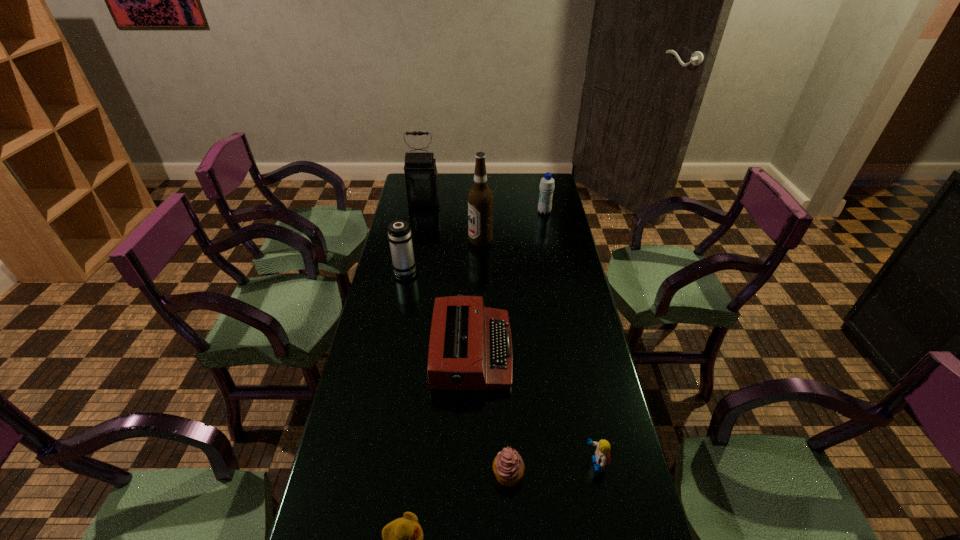
In the image, there is a desktop. At what (x,y) coordinates should I click in order to perform the action: click on vacant space at the far right corner. Please return your answer as a coordinate pair (x, y). Looking at the image, I should click on (539, 179).

I want to click on free space between the typewriter and the water bottle, so click(x=508, y=282).

Where is `free space between the sixth nearest object and the second tallest object`? The height and width of the screenshot is (540, 960). free space between the sixth nearest object and the second tallest object is located at coordinates (452, 221).

At what (x,y) coordinates should I click in order to perform the action: click on free spot between the water bottle and the cupcake. Please return your answer as a coordinate pair (x, y). Looking at the image, I should click on (526, 343).

Where is `vacant region between the second tallest object and the thermos bottle`? The height and width of the screenshot is (540, 960). vacant region between the second tallest object and the thermos bottle is located at coordinates (415, 235).

Identify which object is located as the third nearest to the farthest object. Please provide its 2D coordinates. Your answer should be formatted as a tuple, i.e. [(x, y)], where the tuple contains the x and y coordinates of a point satisfying the conditions above.

[(546, 185)]

Select which object appears as the third closest to the cupcake. Please provide its 2D coordinates. Your answer should be formatted as a tuple, i.e. [(x, y)], where the tuple contains the x and y coordinates of a point satisfying the conditions above.

[(470, 348)]

At what (x,y) coordinates should I click in order to perform the action: click on free spot that satisfies the following two spatial constraints: 1. on the front-facing side of the cupcake; 2. on the left side of the farthest object. Please return your answer as a coordinate pair (x, y). Looking at the image, I should click on (373, 474).

Image resolution: width=960 pixels, height=540 pixels. I want to click on vacant space that satisfies the following two spatial constraints: 1. on the side with the handle of the water bottle; 2. on the right side of the thermos bottle, so click(x=417, y=212).

At what (x,y) coordinates should I click in order to perform the action: click on free location that satisfies the following two spatial constraints: 1. on the side with the handle of the water bottle; 2. on the right side of the thermos bottle. Please return your answer as a coordinate pair (x, y). Looking at the image, I should click on (417, 212).